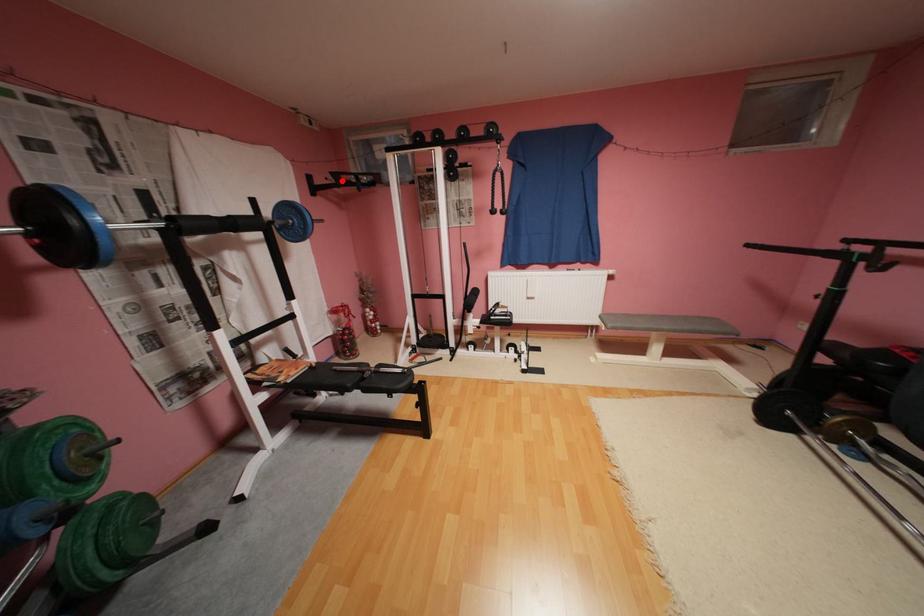
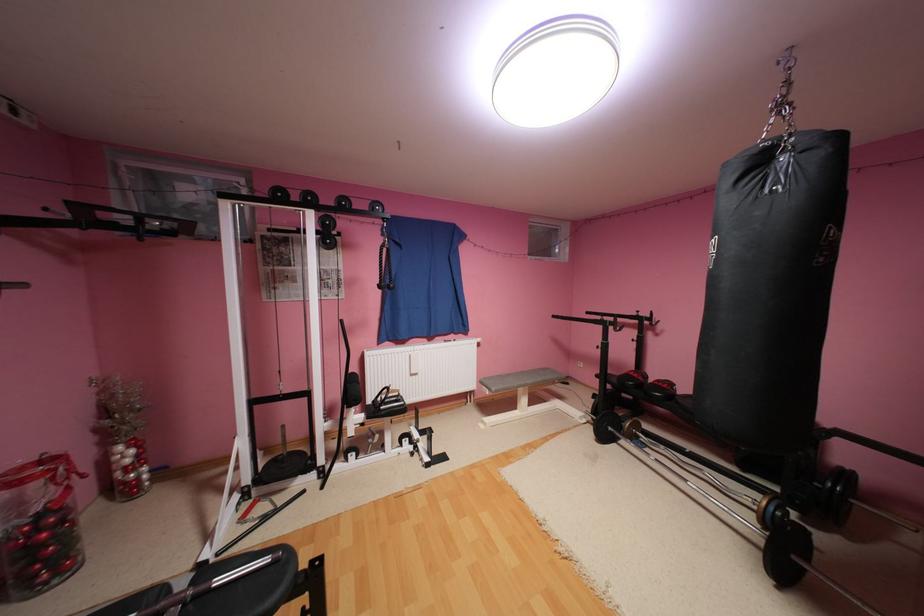
The point at the highlighted location is marked in the first image. Where is the corresponding point in the second image?

(78, 216)